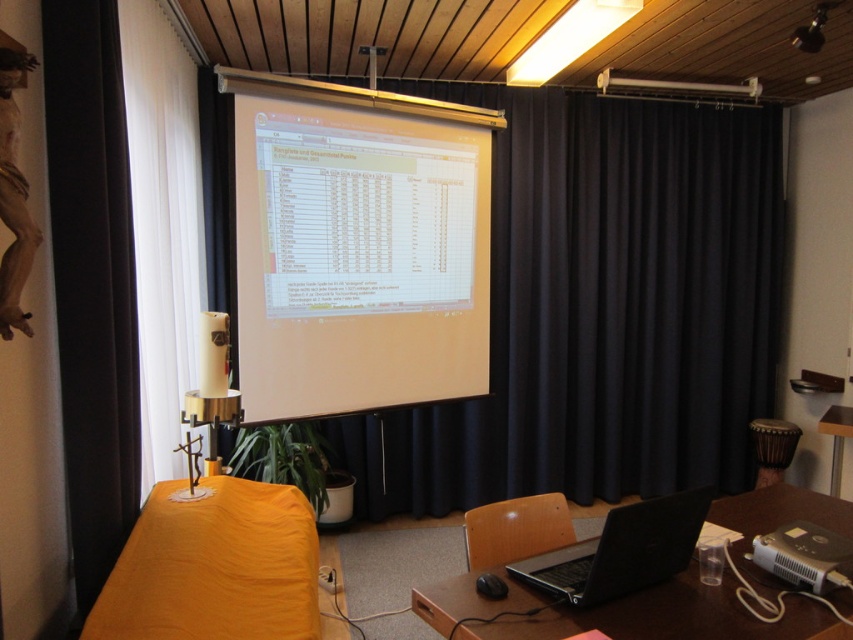
Between point (519, 120) and point (517, 512), which one is positioned in front?

Point (517, 512) is in front.

Is black fabric curtain at upper center further to the viewer compared to wooden chair at lower center?

Yes.

Is point (556, 349) closer to camera compared to point (490, 552)?

No, it is not.

Locate an element on the screen. black fabric curtain at upper center is located at coordinates (602, 310).

Is black fabric curtain at upper center to the right of silver metallic projector at lower right from the viewer's perspective?

No, black fabric curtain at upper center is not to the right of silver metallic projector at lower right.

What do you see at coordinates (602, 310) in the screenshot? This screenshot has height=640, width=853. I see `black fabric curtain at upper center` at bounding box center [602, 310].

Where is `black fabric curtain at upper center`? The width and height of the screenshot is (853, 640). black fabric curtain at upper center is located at coordinates (602, 310).

Who is positioned more to the left, white matte projection screen at center or white fabric curtain at left?

From the viewer's perspective, white fabric curtain at left appears more on the left side.

Is white matte projection screen at center smaller than white fabric curtain at left?

Actually, white matte projection screen at center might be larger than white fabric curtain at left.

Which is in front, point (219, 81) or point (141, 26)?

Point (141, 26) is more forward.

You are a GUI agent. You are given a task and a screenshot of the screen. Output one action in this format:
    pyautogui.click(x=<x>, y=<y>)
    Task: Click on the white matte projection screen at center
    
    Given the screenshot: What is the action you would take?
    click(x=358, y=248)